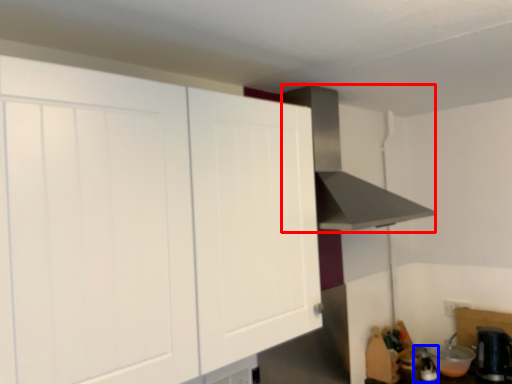
Question: Which object appears closest to the camera in this image, vent (highlighted by a red box) or appliance (highlighted by a blue box)?

Choices:
 (A) vent
 (B) appliance

Answer: (A)